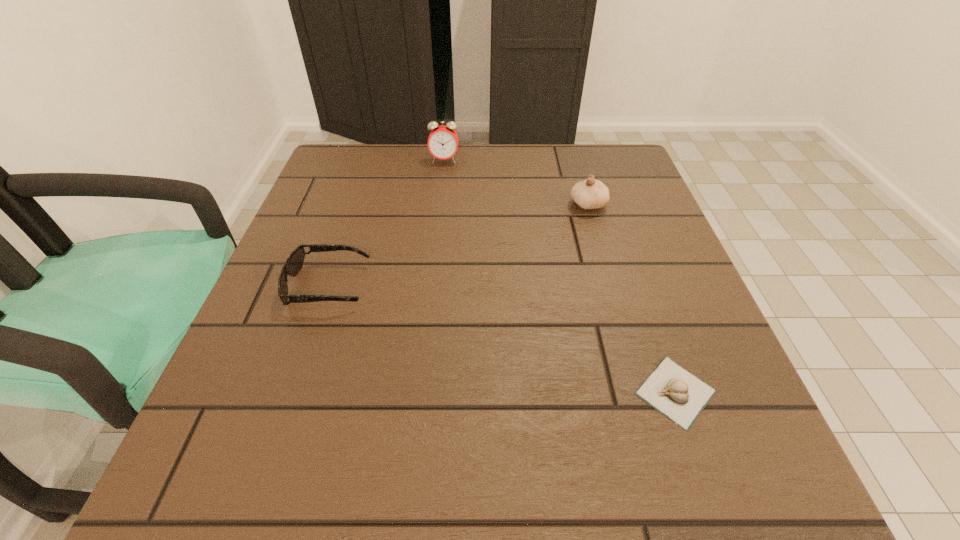
Locate an element on the screen. free point between the taller garlic and the nearest object is located at coordinates (632, 299).

Identify which object is located as the nearest to the tallest object. Please provide its 2D coordinates. Your answer should be formatted as a tuple, i.e. [(x, y)], where the tuple contains the x and y coordinates of a point satisfying the conditions above.

[(589, 194)]

Where is `object that is the closest one to the farther garlic`? object that is the closest one to the farther garlic is located at coordinates (443, 141).

Where is `blank space that satisfies the following two spatial constraints: 1. on the front-facing side of the shortest object; 2. on the left side of the leftmost object`? blank space that satisfies the following two spatial constraints: 1. on the front-facing side of the shortest object; 2. on the left side of the leftmost object is located at coordinates (293, 392).

You are a GUI agent. You are given a task and a screenshot of the screen. Output one action in this format:
    pyautogui.click(x=<x>, y=<y>)
    Task: Click on the blank space that satisfies the following two spatial constraints: 1. on the front-facing side of the alarm clock; 2. on the right side of the nearest object
    
    Given the screenshot: What is the action you would take?
    pyautogui.click(x=419, y=392)

Find the location of a particular element. This screenshot has width=960, height=540. free region that satisfies the following two spatial constraints: 1. on the front side of the second farthest object; 2. on the right side of the shorter garlic is located at coordinates (642, 392).

Where is `free space that satisfies the following two spatial constraints: 1. on the front side of the farther garlic; 2. on the right side of the nearer garlic`? This screenshot has height=540, width=960. free space that satisfies the following two spatial constraints: 1. on the front side of the farther garlic; 2. on the right side of the nearer garlic is located at coordinates (642, 392).

This screenshot has width=960, height=540. I want to click on free spot that satisfies the following two spatial constraints: 1. on the front-facing side of the shorter garlic; 2. on the right side of the leftmost object, so click(x=293, y=392).

Where is `vacant point that satisfies the following two spatial constraints: 1. on the front-facing side of the farther garlic; 2. on the left side of the tallest object`? Image resolution: width=960 pixels, height=540 pixels. vacant point that satisfies the following two spatial constraints: 1. on the front-facing side of the farther garlic; 2. on the left side of the tallest object is located at coordinates (440, 205).

Where is `free spot that satisfies the following two spatial constraints: 1. on the front-facing side of the tallest object; 2. on the right side of the nearer garlic`? free spot that satisfies the following two spatial constraints: 1. on the front-facing side of the tallest object; 2. on the right side of the nearer garlic is located at coordinates (419, 392).